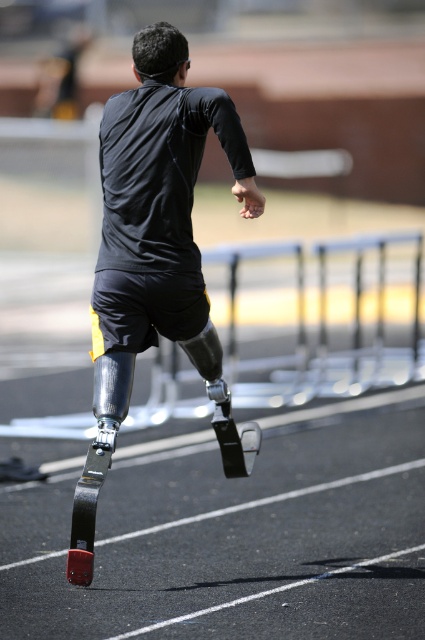
Question: Can you confirm if black rubber race track at lower left is positioned above matte black prosthetic leg at center?

Choices:
 (A) no
 (B) yes

Answer: (A)

Question: Among these objects, which one is farthest from the camera?

Choices:
 (A) matte black prosthetic leg at center
 (B) black rubber race track at lower left

Answer: (A)

Question: Does black rubber race track at lower left have a lesser width compared to matte black prosthetic leg at center?

Choices:
 (A) no
 (B) yes

Answer: (A)

Question: Is black rubber race track at lower left below matte black prosthetic leg at center?

Choices:
 (A) no
 (B) yes

Answer: (B)